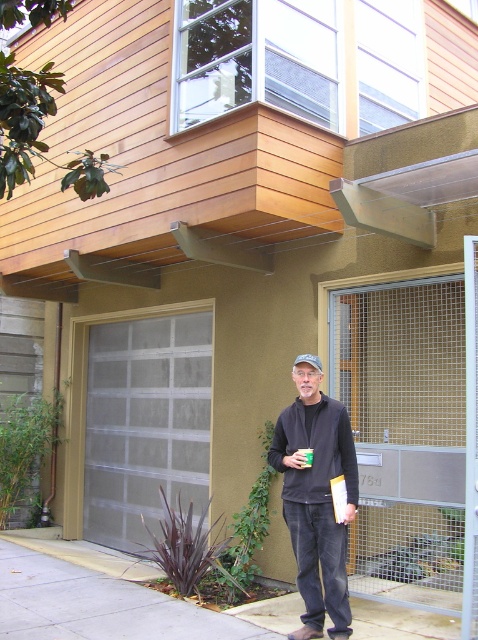
Who is shorter, gray textured garage door at center or black matte jacket at center?

black matte jacket at center is shorter.

Is gray textured garage door at center behind black matte jacket at center?

Yes, gray textured garage door at center is behind black matte jacket at center.

What do you see at coordinates (138, 420) in the screenshot? I see `gray textured garage door at center` at bounding box center [138, 420].

The width and height of the screenshot is (478, 640). I want to click on gray textured garage door at center, so click(x=138, y=420).